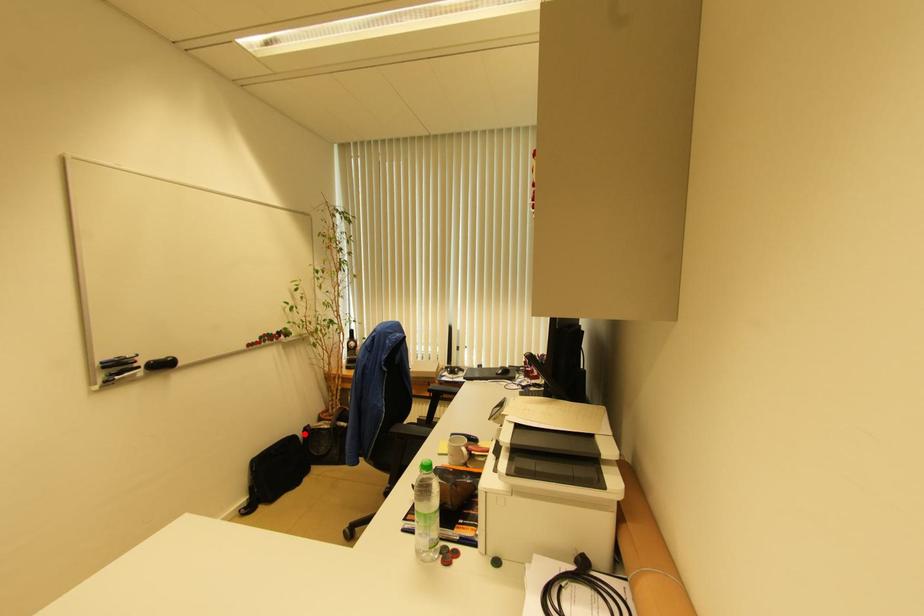
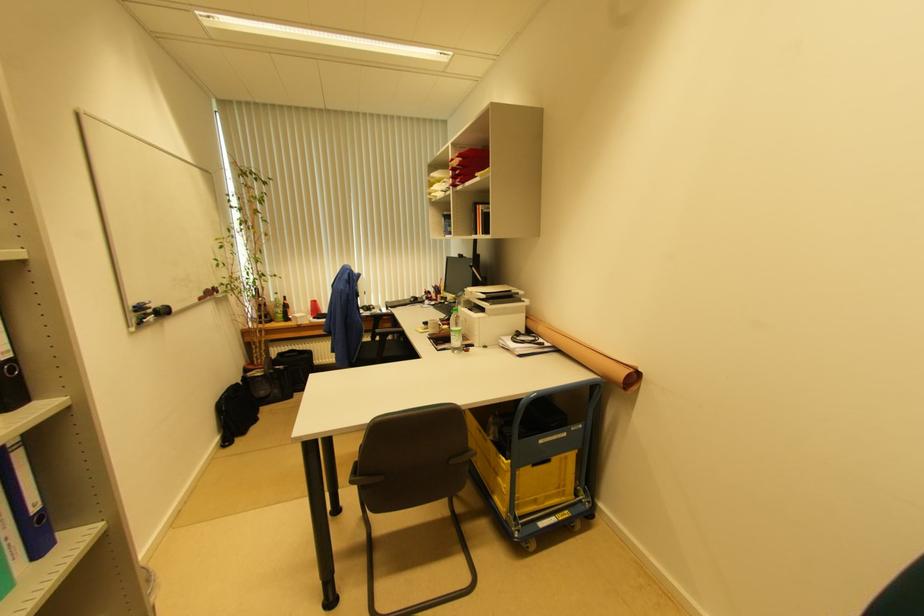
Locate, in the second image, the point that corresponds to the highlighted location in the first image.

(242, 383)